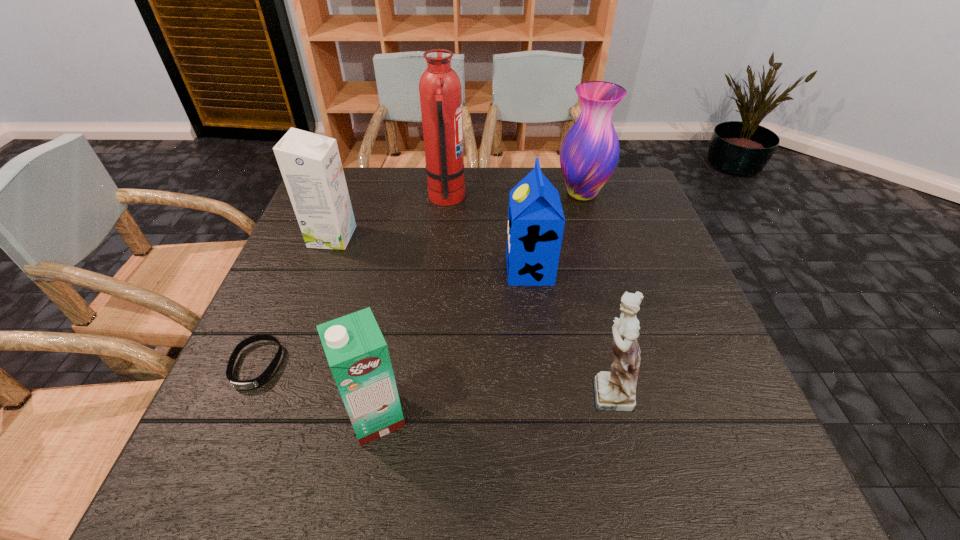
You are a GUI agent. You are given a task and a screenshot of the screen. Output one action in this format:
    pyautogui.click(x=<x>, y=<y>)
    Task: Click on the fire extinguisher that is at the far edge
    
    Given the screenshot: What is the action you would take?
    pyautogui.click(x=440, y=89)

This screenshot has height=540, width=960. Identify the location of vase situated at the far edge. (589, 153).

I want to click on object present at the near edge, so click(x=357, y=353).

This screenshot has width=960, height=540. I want to click on carton that is at the left edge, so click(x=310, y=164).

Locate an element on the screen. The height and width of the screenshot is (540, 960). wristband present at the left edge is located at coordinates (264, 377).

The image size is (960, 540). I want to click on object that is positioned at the right edge, so click(x=589, y=153).

The width and height of the screenshot is (960, 540). What are the coordinates of `object present at the far right corner` in the screenshot? It's located at (589, 153).

In the image, there is a desktop. What are the coordinates of `free region at the far edge` in the screenshot? It's located at (469, 186).

You are a GUI agent. You are given a task and a screenshot of the screen. Output one action in this format:
    pyautogui.click(x=<x>, y=<y>)
    Task: Click on the free region at the near edge
    Image resolution: width=960 pixels, height=540 pixels.
    Given the screenshot: What is the action you would take?
    pyautogui.click(x=362, y=483)

The width and height of the screenshot is (960, 540). In the image, there is a desktop. Find the location of `vacant space at the left edge`. vacant space at the left edge is located at coordinates (276, 300).